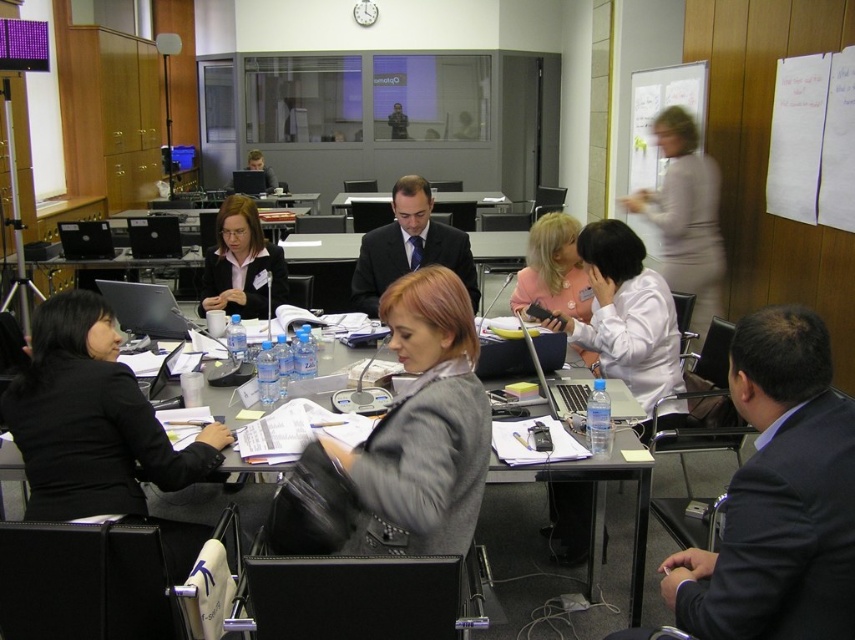
You are standing in the office and want to take a photo of both point (293, 515) and point (568, 483). Which point should you focus on first to ensure both are in clear view?

You should focus on point (293, 515) first because it is closer to the camera than point (568, 483), ensuring both points are in focus.

Consider the image. You are standing in the office and need to locate the dark gray suit at center right. Which direction should you look to find the point at coordinate (783, 536)?

The point at coordinate (783, 536) is located on the dark gray suit at center right, so you should look towards the center right direction to find it.